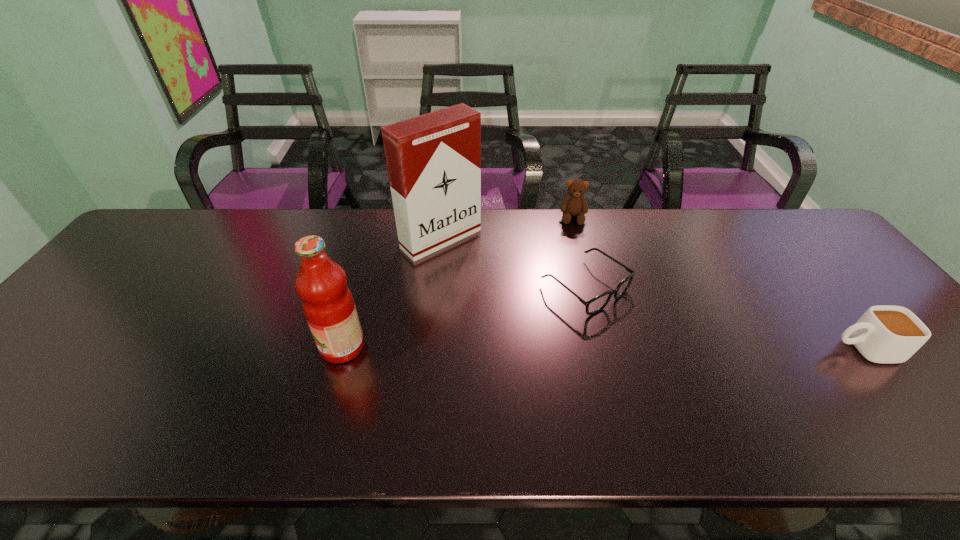
Where is `free space located on the front label of the leftmost object`? The height and width of the screenshot is (540, 960). free space located on the front label of the leftmost object is located at coordinates (204, 347).

Image resolution: width=960 pixels, height=540 pixels. I want to click on vacant space located on the side with the handle of the rightmost object, so click(701, 349).

Where is `vacant space located 0.360m on the side with the handle of the rightmost object`? The image size is (960, 540). vacant space located 0.360m on the side with the handle of the rightmost object is located at coordinates (680, 349).

Locate an element on the screen. free space located on the side with the handle of the rightmost object is located at coordinates (777, 349).

At what (x,y) coordinates should I click in order to perform the action: click on free spot located on the front-facing side of the tallest object. Please return your answer as a coordinate pair (x, y). Looking at the image, I should click on (521, 306).

This screenshot has width=960, height=540. Identify the location of free space located 0.360m on the front-facing side of the tallest object. pos(551,331).

Where is `blank space located on the front-facing side of the tallest object`? The height and width of the screenshot is (540, 960). blank space located on the front-facing side of the tallest object is located at coordinates (488, 276).

Where is `vacant space located 0.300m on the front-facing side of the shortest object`? vacant space located 0.300m on the front-facing side of the shortest object is located at coordinates (731, 393).

This screenshot has height=540, width=960. In order to click on free space located on the front-facing side of the shortest object in this screenshot , I will do `click(682, 357)`.

The height and width of the screenshot is (540, 960). Find the location of `blank area located on the front-facing side of the shortest object`. blank area located on the front-facing side of the shortest object is located at coordinates (689, 362).